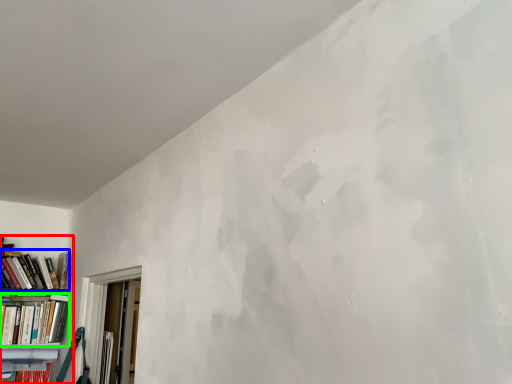
Question: Which object is positioned farthest from bookcase (highlighted by a red box)? Select from book (highlighted by a blue box) and book (highlighted by a green box).

Choices:
 (A) book
 (B) book

Answer: (A)